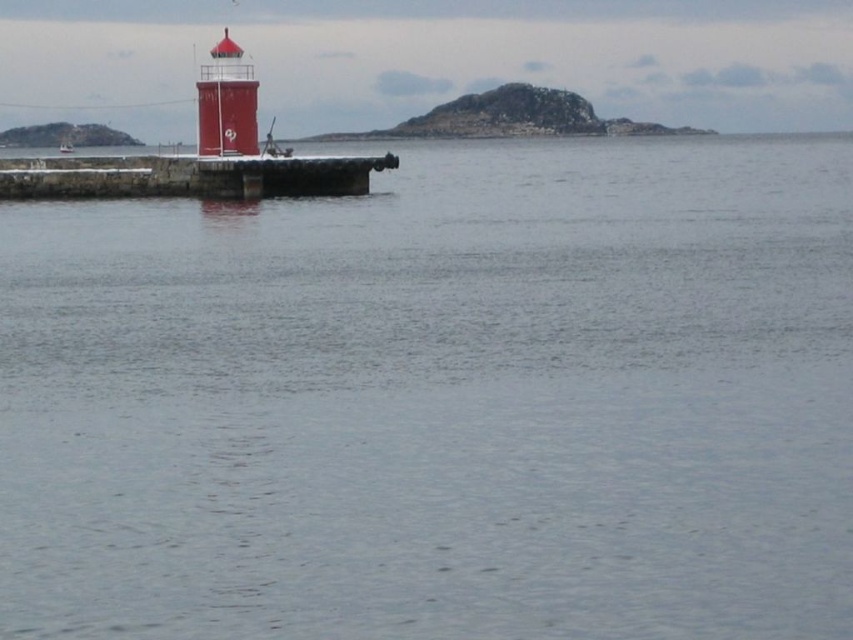
Is smooth red lighthouse at center below metallic silver boat at left?

Yes, smooth red lighthouse at center is below metallic silver boat at left.

Measure the distance between point (x=252, y=97) and camera.

Point (x=252, y=97) is 63.40 meters away from camera.

The width and height of the screenshot is (853, 640). I want to click on smooth red lighthouse at center, so click(x=225, y=102).

Can you confirm if smooth stone dock at center is positioned to the left of smooth red lighthouse at center?

Indeed, smooth stone dock at center is positioned on the left side of smooth red lighthouse at center.

Is smooth stone dock at center positioned at the back of smooth red lighthouse at center?

No, smooth stone dock at center is closer to the viewer.

Who is more distant from viewer, (115, 179) or (228, 83)?

Positioned behind is point (228, 83).

Find the location of a particular element. The image size is (853, 640). smooth stone dock at center is located at coordinates (189, 177).

Which of these two, smooth stone dock at center or metallic silver boat at left, stands shorter?

smooth stone dock at center

Does smooth stone dock at center come in front of metallic silver boat at left?

Yes, it is in front of metallic silver boat at left.

The height and width of the screenshot is (640, 853). In order to click on smooth stone dock at center in this screenshot , I will do `click(189, 177)`.